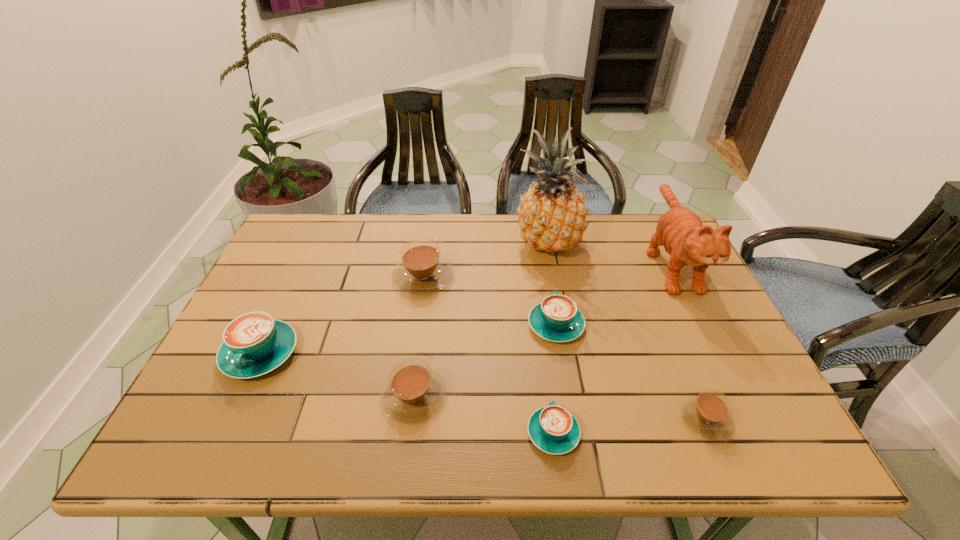
This screenshot has width=960, height=540. I want to click on vacant space situated with the handle on the right side of the second biggest turquoise cappuccino, so (549, 282).

This screenshot has height=540, width=960. In order to click on vacant space positioned on the back of the rightmost brown cappuccino in this screenshot , I will do `click(650, 286)`.

This screenshot has height=540, width=960. I want to click on free space located 0.120m with the handle on the right side of the smallest turquoise cappuccino, so click(x=544, y=364).

Find the location of a particular element. The width and height of the screenshot is (960, 540). free space located 0.380m with the handle on the right side of the smallest turquoise cappuccino is located at coordinates (534, 289).

What are the coordinates of `vacant region located 0.340m with the handle on the right side of the smallest turquoise cappuccino` in the screenshot? It's located at (536, 299).

Identify the location of pineapple present at the far edge. This screenshot has width=960, height=540. (552, 216).

Where is `cat positioned at the far edge`? cat positioned at the far edge is located at coordinates (686, 240).

What are the coordinates of `cappuccino located at the far edge` in the screenshot? It's located at 422,270.

Locate an element on the screen. The width and height of the screenshot is (960, 540). object located at the left edge is located at coordinates (254, 343).

The height and width of the screenshot is (540, 960). I want to click on cat that is positioned at the right edge, so click(686, 240).